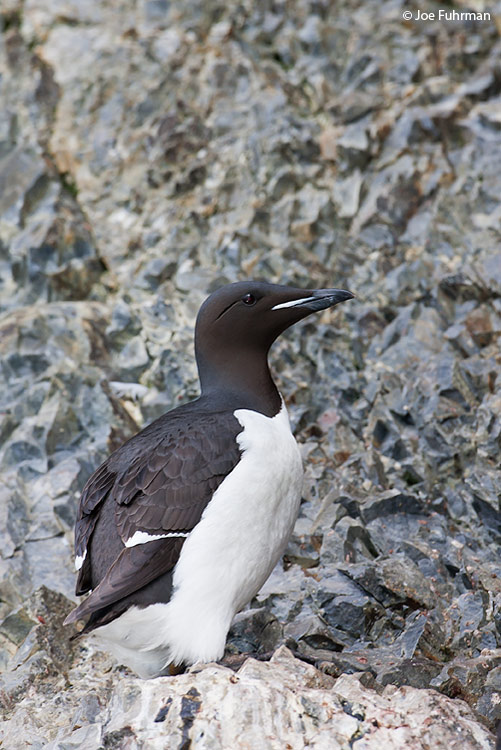
The image size is (501, 750). What are the coordinates of `chest` in the screenshot? It's located at (250, 540).